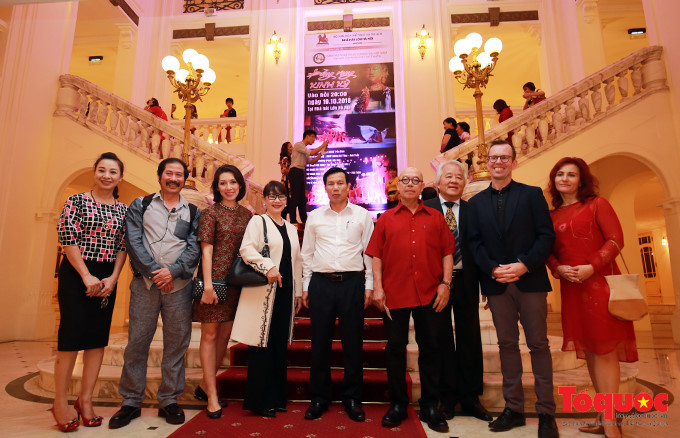
At what (x,y) coordinates should I click in order to perform the action: click on archway. Please return your answer as a coordinate pair (x, y). This screenshot has width=680, height=438. Looking at the image, I should click on coord(636,194).